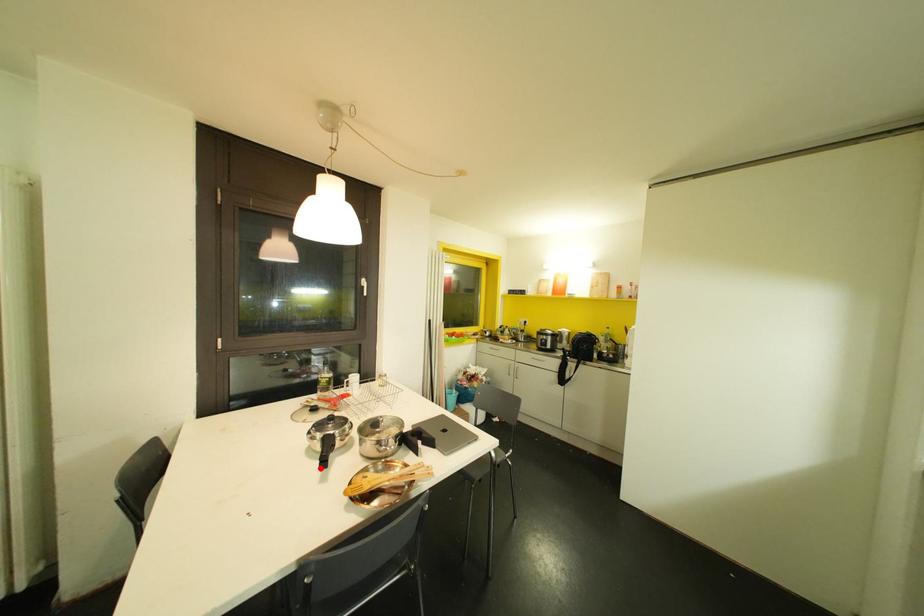
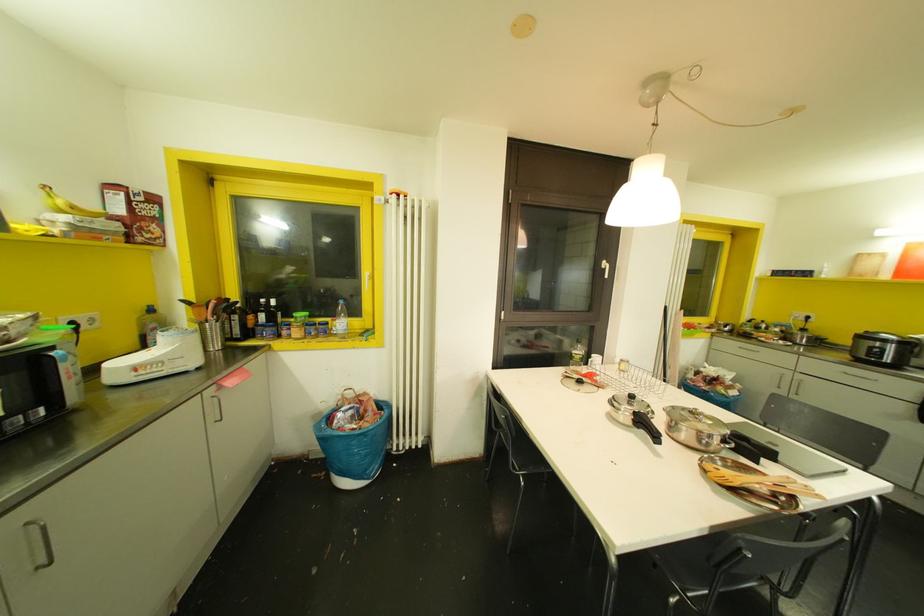
Where in the second image is the point corresponding to the highlighted location from the first image?

(660, 444)